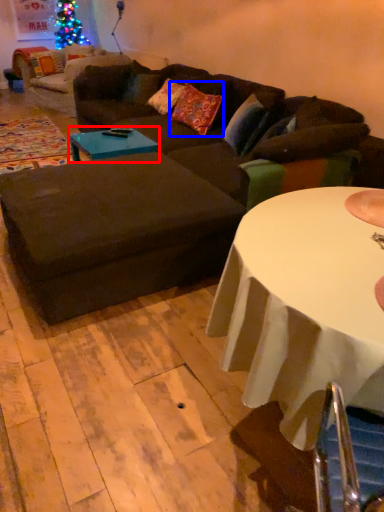
Question: Which point is further to the camera, coffee table (highlighted by a red box) or pillow (highlighted by a blue box)?

Choices:
 (A) coffee table
 (B) pillow

Answer: (B)